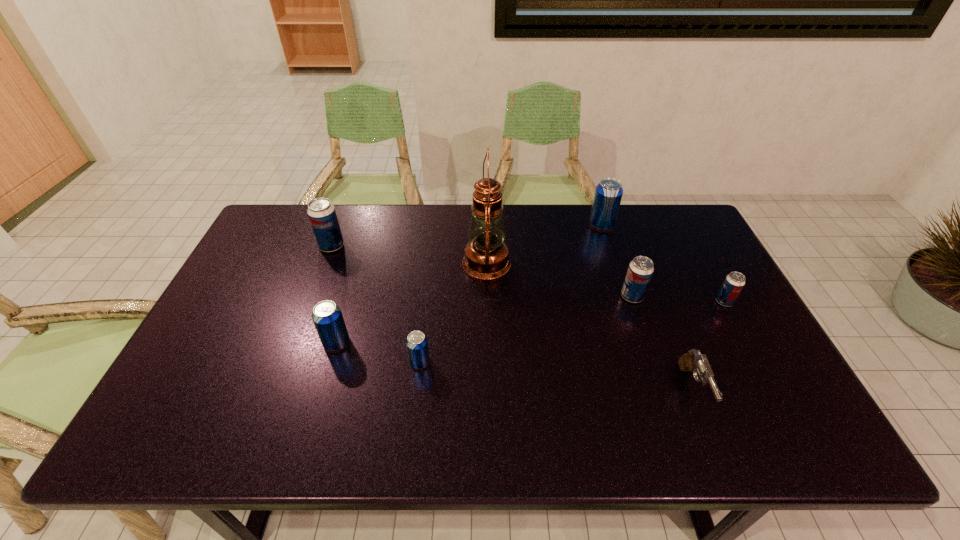
At what (x,y) coordinates should I click in order to perform the action: click on the tallest object. Please return your answer as a coordinate pair (x, y). Looking at the image, I should click on (486, 257).

Where is `oil lamp`? oil lamp is located at coordinates (486, 257).

The height and width of the screenshot is (540, 960). I want to click on the second farthest beer can, so click(321, 212).

Locate an element on the screen. the biggest red beer can is located at coordinates click(x=321, y=212).

Identify the location of the farthest beer can. This screenshot has width=960, height=540. (608, 194).

This screenshot has width=960, height=540. What are the coordinates of `the farthest object` in the screenshot? It's located at (608, 194).

Find the location of a particular element. The image size is (960, 540). the second red beer can from right to left is located at coordinates (640, 270).

I want to click on the sixth farthest object, so click(327, 316).

Where is `the second object from left to right`? The image size is (960, 540). the second object from left to right is located at coordinates (327, 316).

The width and height of the screenshot is (960, 540). I want to click on pistol, so click(x=693, y=361).